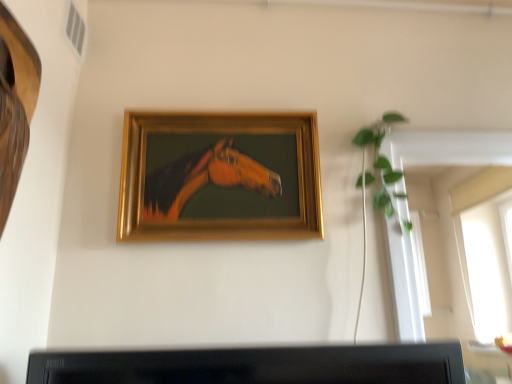
Question: Is gold wooden picture frame at center to the left or to the right of green leafy plant at upper right in the image?

Choices:
 (A) right
 (B) left

Answer: (B)

Question: Considering the positions of point (272, 135) and point (385, 183), is point (272, 135) closer or farther from the camera than point (385, 183)?

Choices:
 (A) farther
 (B) closer

Answer: (A)

Question: Is gold wooden picture frame at center situated inside green leafy plant at upper right or outside?

Choices:
 (A) inside
 (B) outside

Answer: (B)

Question: Considering the relative positions of green leafy plant at upper right and gold wooden picture frame at center in the image provided, is green leafy plant at upper right to the left or to the right of gold wooden picture frame at center?

Choices:
 (A) left
 (B) right

Answer: (B)

Question: Does point (372, 178) appear closer or farther from the camera than point (295, 157)?

Choices:
 (A) farther
 (B) closer

Answer: (A)

Question: Is green leafy plant at upper right inside the boundaries of gold wooden picture frame at center, or outside?

Choices:
 (A) inside
 (B) outside

Answer: (B)

Question: Is green leafy plant at upper right taller or shorter than gold wooden picture frame at center?

Choices:
 (A) short
 (B) tall

Answer: (A)